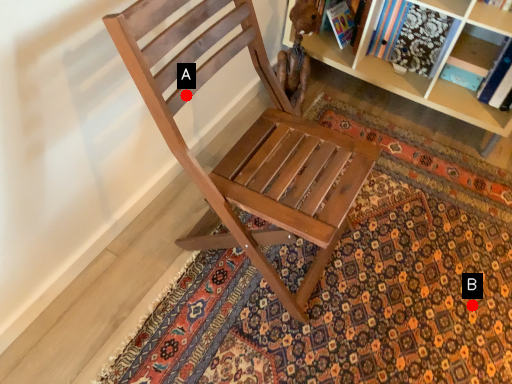
Question: Two points are circled on the image, labeled by A and B beside each circle. Among these points, which one is nearest to the camera?

Choices:
 (A) A is closer
 (B) B is closer

Answer: (A)